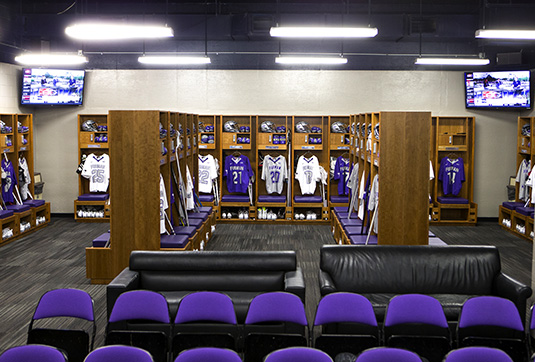
Locate an element on the screen. vents is located at coordinates point(425,23), point(257,23), point(119,19).